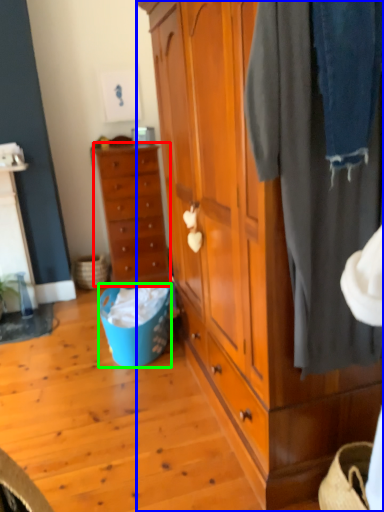
Question: Which object is positioned farthest from chest of drawers (highlighted by a red box)? Select from cabinetry (highlighted by a blue box) and picnic basket (highlighted by a green box).

Choices:
 (A) cabinetry
 (B) picnic basket

Answer: (A)